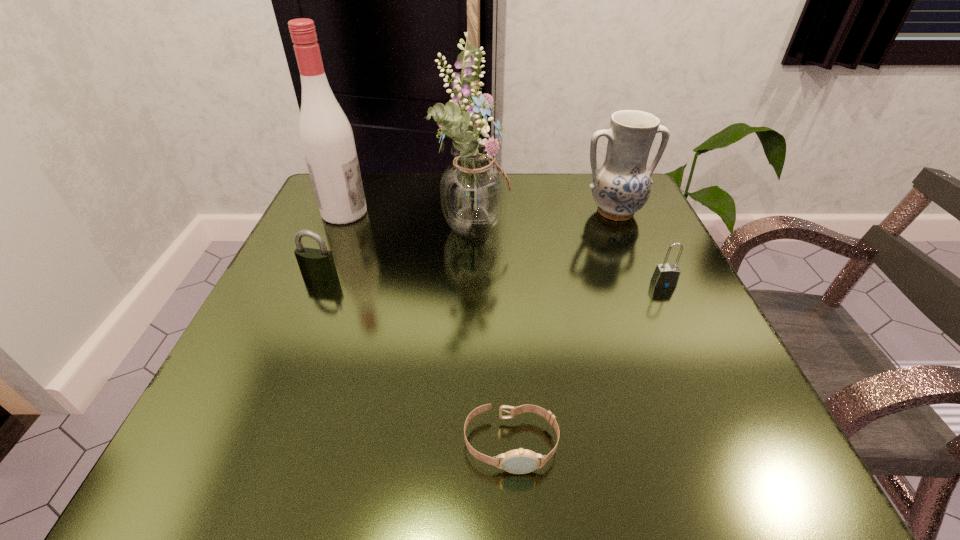
I want to click on free space located on the back of the left padlock, so click(x=348, y=211).

Image resolution: width=960 pixels, height=540 pixels. In order to click on free spot located on the shackle of the right padlock in this screenshot , I will do (x=691, y=343).

The image size is (960, 540). Identify the location of alcohol located at the far edge. (326, 136).

You are a GUI agent. You are given a task and a screenshot of the screen. Output one action in this format:
    pyautogui.click(x=<x>, y=<y>)
    Task: Click on the bouquet at the far edge
    The width and height of the screenshot is (960, 540).
    Given the screenshot: What is the action you would take?
    pyautogui.click(x=473, y=189)

You are a GUI agent. You are given a task and a screenshot of the screen. Output one action in this format:
    pyautogui.click(x=<x>, y=<y>)
    Task: Click on the pottery situated at the far edge
    The height and width of the screenshot is (540, 960).
    Given the screenshot: What is the action you would take?
    pyautogui.click(x=621, y=186)

The height and width of the screenshot is (540, 960). Find the location of `object positioned at the near edge`. object positioned at the near edge is located at coordinates (518, 461).

Find the location of a particular element. The width and height of the screenshot is (960, 540). alcohol that is at the left edge is located at coordinates (326, 136).

Where is `padlock at the left edge`? padlock at the left edge is located at coordinates (318, 264).

What are the coordinates of `pottery present at the right edge` in the screenshot? It's located at (621, 186).

Where is `padlock that is at the right edge`? This screenshot has width=960, height=540. padlock that is at the right edge is located at coordinates 666,275.